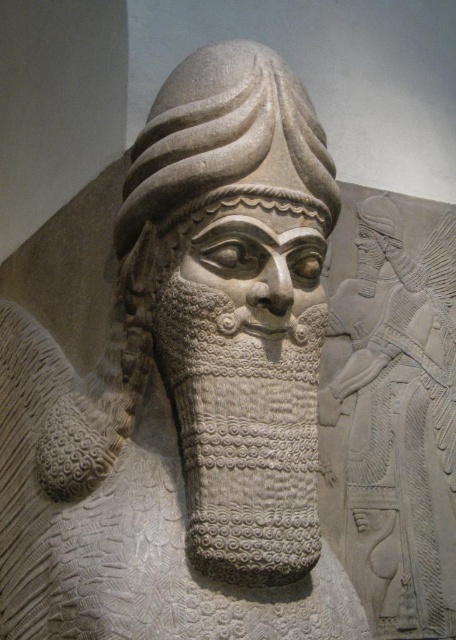
Is gray stone head at center shorter than gray stone head at upper right?

In fact, gray stone head at center may be taller than gray stone head at upper right.

Between point (245, 156) and point (382, 196), which one is positioned in front?

Point (245, 156)

Does point (242, 65) come behind point (358, 227)?

No, (242, 65) is closer to viewer.

I want to click on gray stone head at center, so click(226, 141).